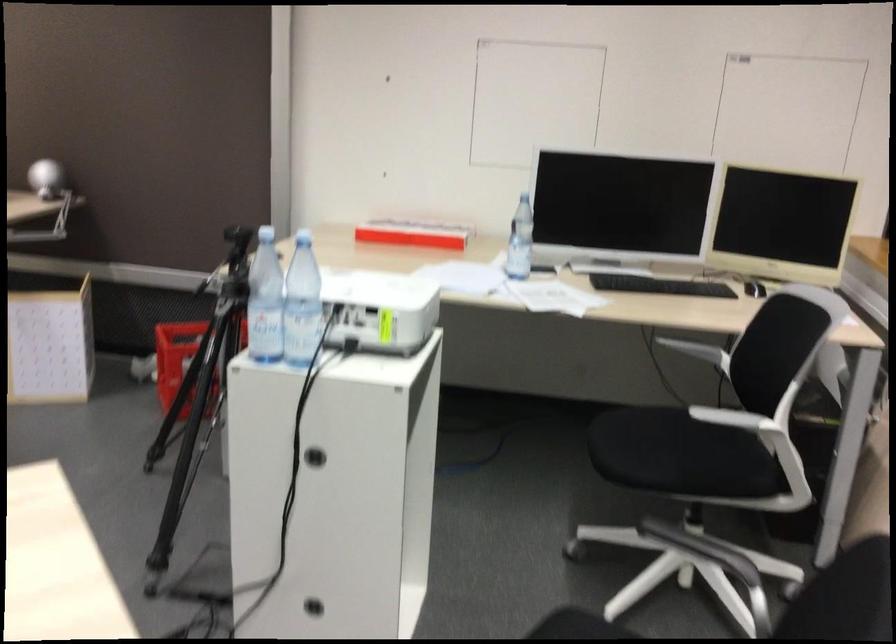
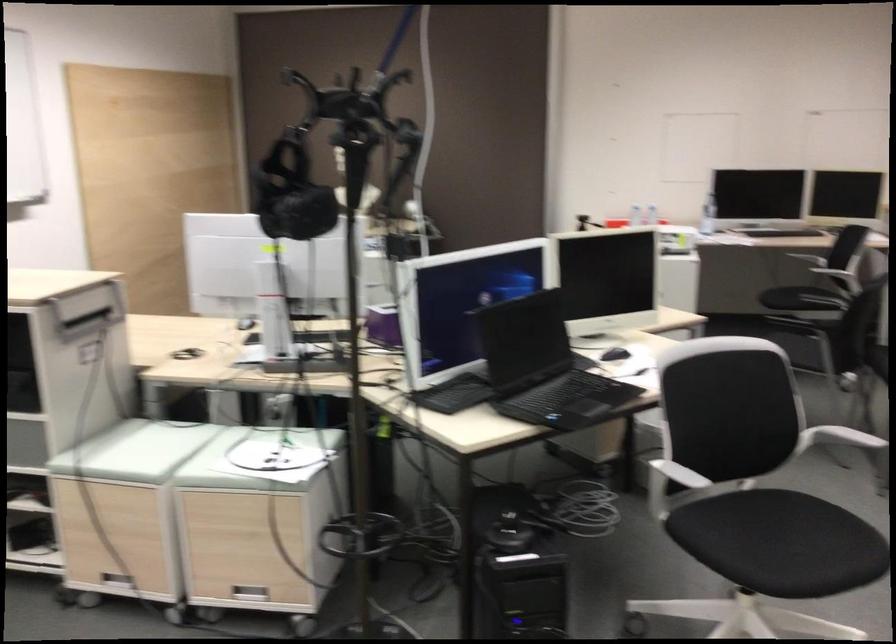
Question: I am providing you with two images of the same scene from different viewpoints. Please identify which objects are invisible in image2.

Choices:
 (A) black VR headset
 (B) metal drawer handle
 (C) white clipboard
 (D) plastic water bottle

Answer: (D)